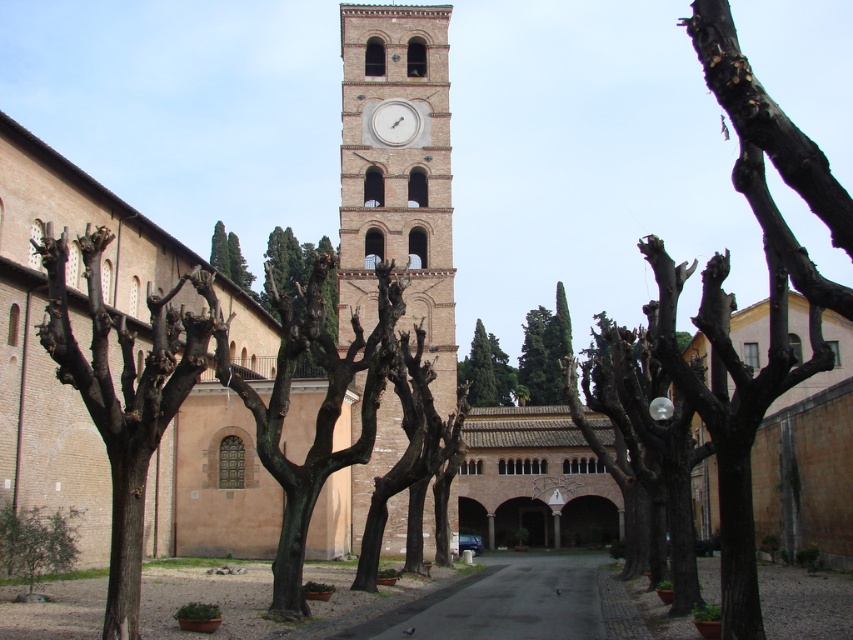
Question: Is dark asphalt road at center thinner than green leafy tree at lower left?

Choices:
 (A) yes
 (B) no

Answer: (B)

Question: Estimate the real-world distances between objects in this image. Which object is closer to the dark asphalt road at center?

Choices:
 (A) green leafy tree at lower left
 (B) brick clock tower at center
 (C) bare wood tree at left
 (D) white glossy clock at center

Answer: (C)

Question: Which object is positioned farthest from the brick clock tower at center?

Choices:
 (A) white glossy clock at center
 (B) bare wood tree at left
 (C) green leafy tree at center

Answer: (C)

Question: Is the position of bare wood tree at left more distant than that of green leafy tree at lower left?

Choices:
 (A) no
 (B) yes

Answer: (A)

Question: Does dark asphalt road at center appear on the right side of green leafy tree at center?

Choices:
 (A) no
 (B) yes

Answer: (A)

Question: Which of the following is the farthest from the observer?

Choices:
 (A) green leafy tree at center
 (B) dark asphalt road at center
 (C) green leafy tree at lower left
 (D) brick clock tower at center

Answer: (A)